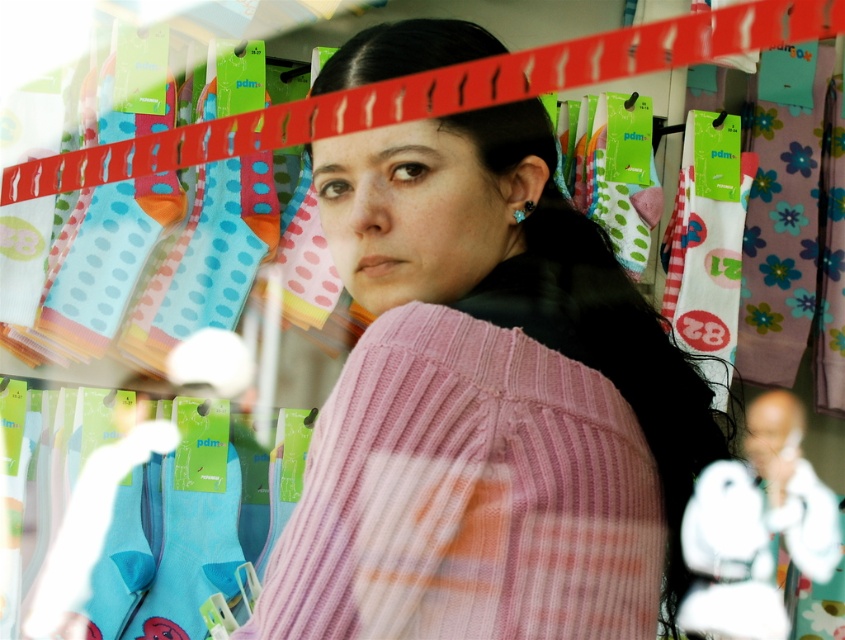
The width and height of the screenshot is (845, 640). Describe the element at coordinates (488, 401) in the screenshot. I see `pink ribbed sweater at center` at that location.

Which is behind, point (601, 416) or point (829, 572)?

The point (829, 572) is behind.

The height and width of the screenshot is (640, 845). I want to click on pink ribbed sweater at center, so click(x=488, y=401).